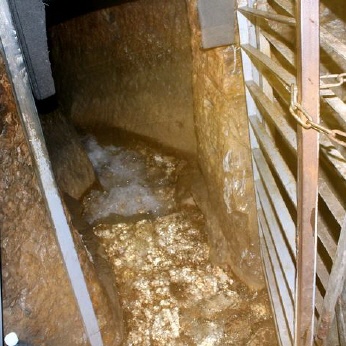
Image resolution: width=346 pixels, height=346 pixels. I want to click on wooden frame, so click(304, 201), click(338, 259).